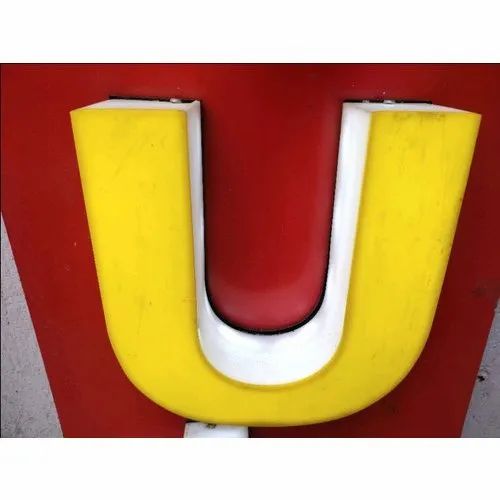
This screenshot has width=500, height=500. I want to click on red paint, so click(274, 113).